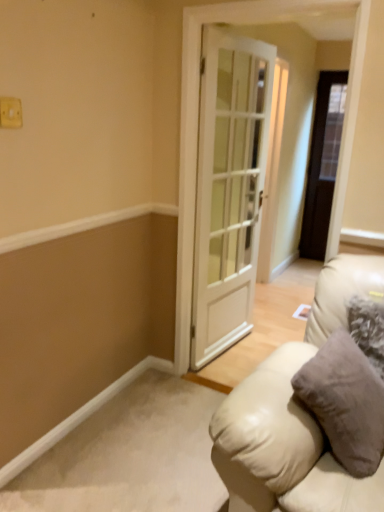
Question: Is white plastic light switch at upper left not near dark wood door at right, which is the 1th door in back-to-front order?

Choices:
 (A) yes
 (B) no

Answer: (A)

Question: Is white plastic light switch at upper left located outside dark wood door at right, marked as the second door in a front-to-back arrangement?

Choices:
 (A) no
 (B) yes

Answer: (B)

Question: From a real-world perspective, is white plastic light switch at upper left over dark wood door at right, marked as the second door in a front-to-back arrangement?

Choices:
 (A) no
 (B) yes

Answer: (B)

Question: Considering the relative sizes of white plastic light switch at upper left and dark wood door at right, marked as the second door in a front-to-back arrangement, in the image provided, is white plastic light switch at upper left wider than dark wood door at right, marked as the second door in a front-to-back arrangement,?

Choices:
 (A) yes
 (B) no

Answer: (B)

Question: Is white plastic light switch at upper left closer to camera compared to dark wood door at right, placed as the 1th door when sorted from right to left?

Choices:
 (A) no
 (B) yes

Answer: (B)

Question: In the image, is white plastic light switch at upper left positioned in front of or behind white glass door at center, arranged as the first door when viewed from the front?

Choices:
 (A) front
 (B) behind

Answer: (A)

Question: From a real-world perspective, is white plastic light switch at upper left above or below white glass door at center, the 2th door in the right-to-left sequence?

Choices:
 (A) above
 (B) below

Answer: (A)

Question: Is white plastic light switch at upper left taller or shorter than white glass door at center, arranged as the first door when viewed from the front?

Choices:
 (A) tall
 (B) short

Answer: (B)

Question: Is white plastic light switch at upper left inside or outside of white glass door at center, the 2th door in the right-to-left sequence?

Choices:
 (A) outside
 (B) inside

Answer: (A)

Question: From a real-world perspective, is dark wood door at right, placed as the 1th door when sorted from right to left, physically located above or below white plastic light switch at upper left?

Choices:
 (A) below
 (B) above

Answer: (A)

Question: Is point (324, 189) closer or farther from the camera than point (14, 97)?

Choices:
 (A) closer
 (B) farther

Answer: (B)

Question: Is dark wood door at right, placed as the 1th door when sorted from right to left, in front of or behind white plastic light switch at upper left in the image?

Choices:
 (A) behind
 (B) front

Answer: (A)

Question: Choose the correct answer: Is dark wood door at right, which is the 1th door in back-to-front order, inside white plastic light switch at upper left or outside it?

Choices:
 (A) outside
 (B) inside

Answer: (A)

Question: From a real-world perspective, is beige leather couch at lower right above or below dark wood door at right, placed as the 1th door when sorted from right to left?

Choices:
 (A) below
 (B) above

Answer: (A)

Question: Considering the positions of point (375, 274) and point (332, 104), is point (375, 274) closer or farther from the camera than point (332, 104)?

Choices:
 (A) closer
 (B) farther

Answer: (A)